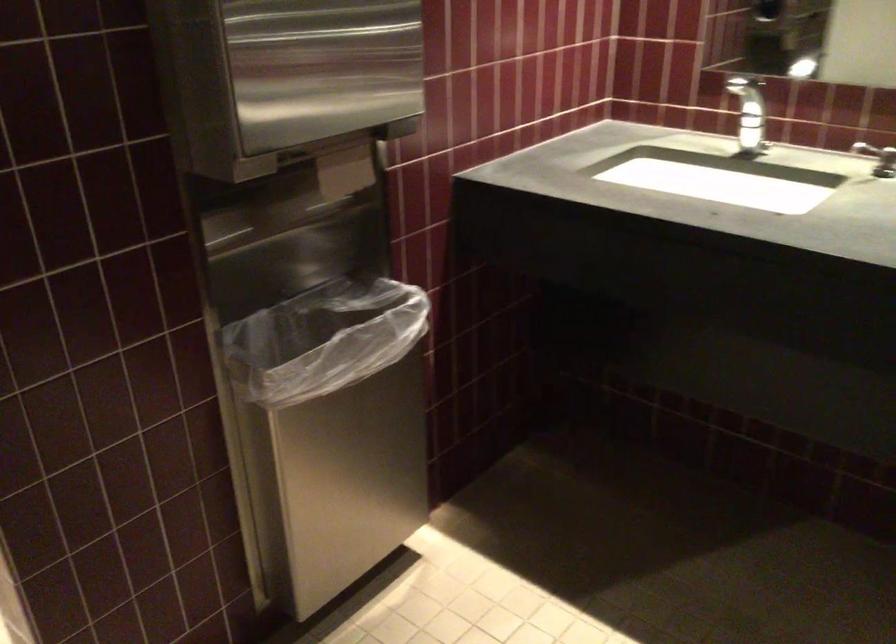
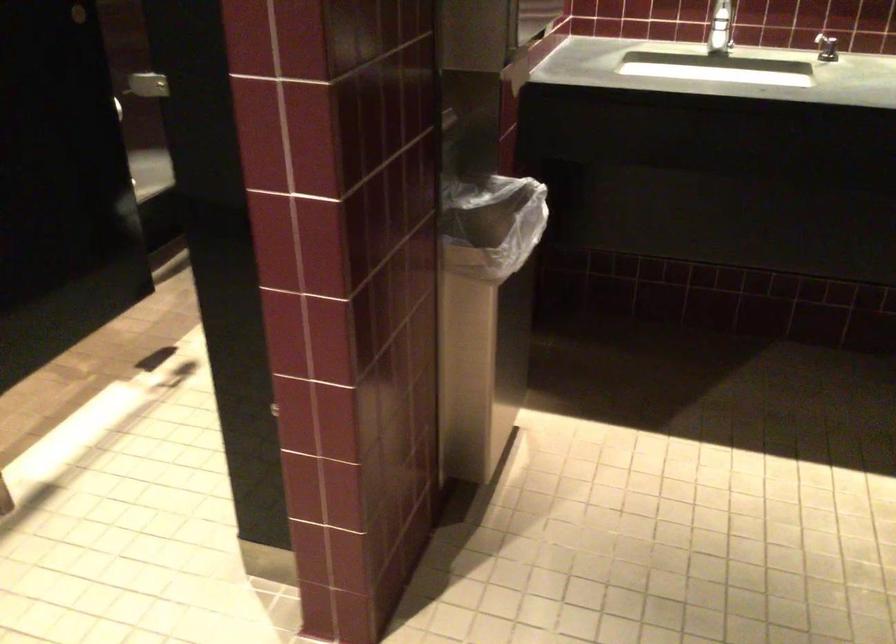
Question: How did the camera likely rotate?

Choices:
 (A) Left
 (B) Right
 (C) Up
 (D) Down

Answer: (B)